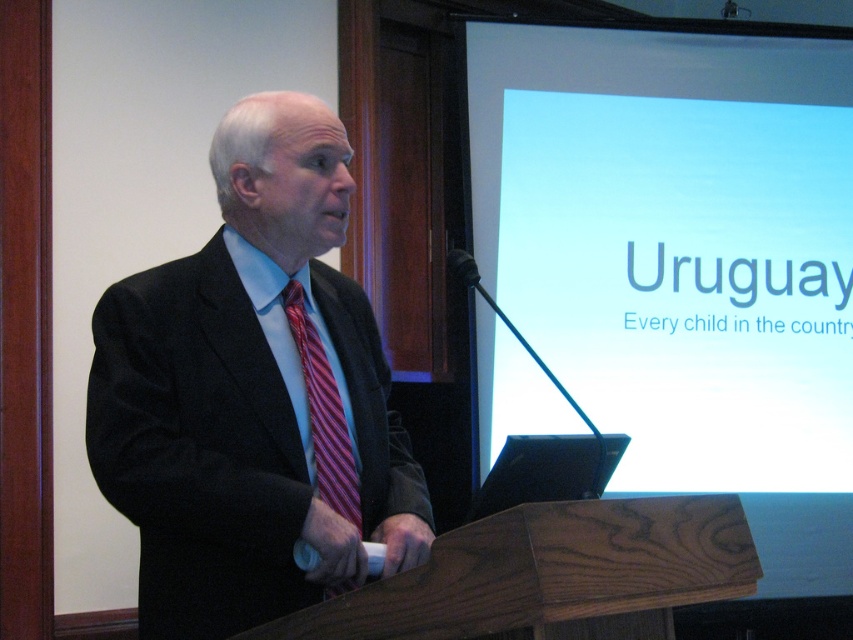
Consider the image. You are an event organizer setting up the stage for a presentation. You need to ensure that the speaker can see the white glossy screen at upper center while facing the audience. Since the speaker is wearing the matte black suit at center, will the screen be visible to him from his position at the podium?

The white glossy screen at upper center is located above the matte black suit at center, so the speaker wearing the matte black suit at center should be able to see the screen positioned above him as long as there are no obstructions between them.